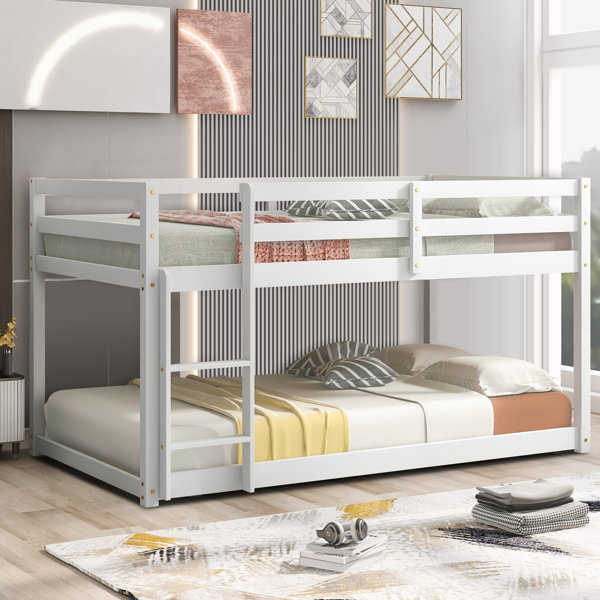
Locate an element on the screen. Image resolution: width=600 pixels, height=600 pixels. blue and white striped wall is located at coordinates (292, 161).